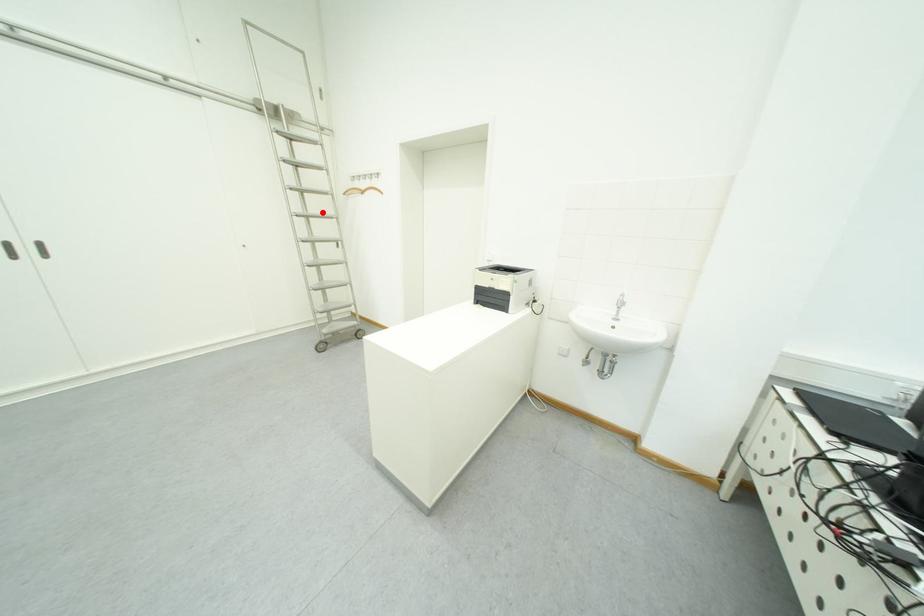
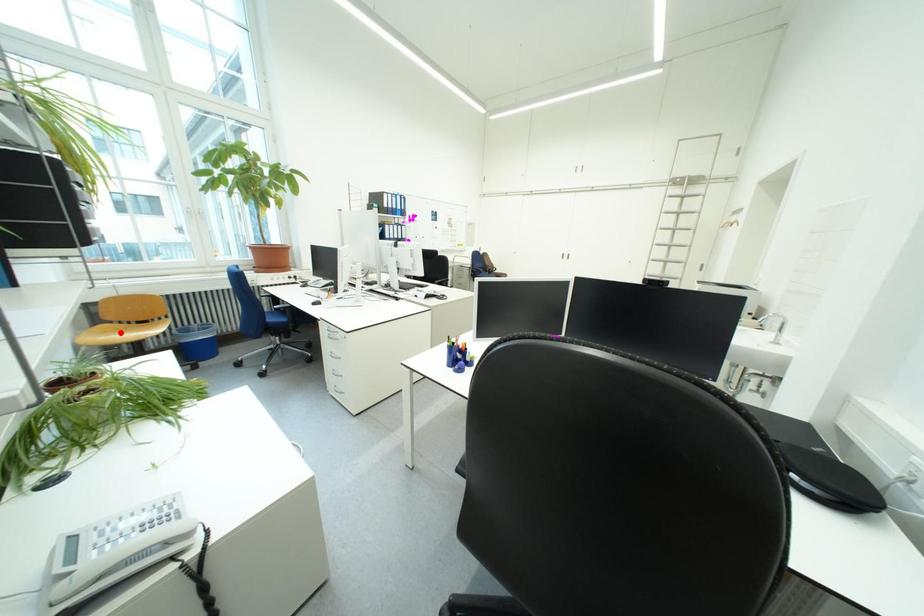
I am providing you with two images of the same scene from different viewpoints. A red point is marked on the first image and another point is marked on the second image. Do the highlighted points in image1 and image2 indicate the same real-world spot?

No